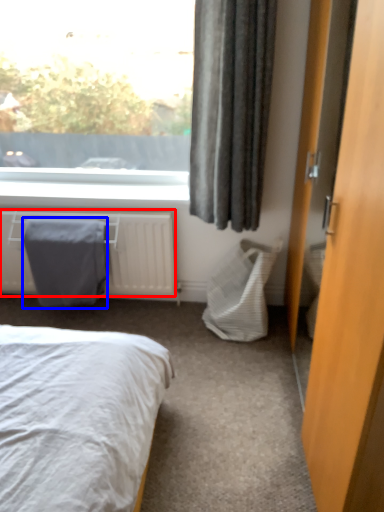
Question: Which of the following is the closest to the observer, radiator (highlighted by a red box) or blanket (highlighted by a blue box)?

Choices:
 (A) radiator
 (B) blanket

Answer: (A)